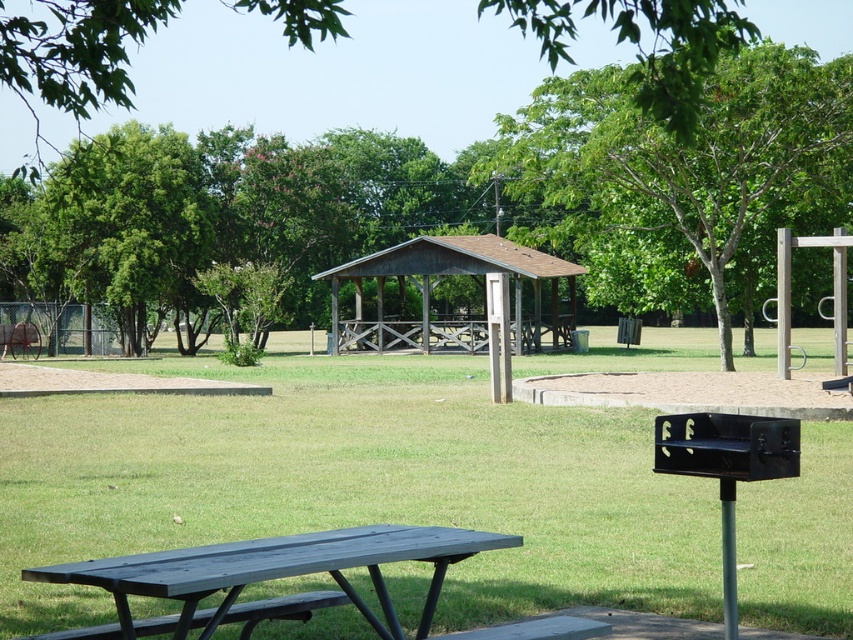
This screenshot has width=853, height=640. What do you see at coordinates (352, 484) in the screenshot?
I see `green grass at center` at bounding box center [352, 484].

You are a GUI agent. You are given a task and a screenshot of the screen. Output one action in this format:
    pyautogui.click(x=<x>, y=<y>)
    Task: Click on the green grass at center
    Image resolution: width=853 pixels, height=640 pixels.
    Given the screenshot: What is the action you would take?
    pyautogui.click(x=352, y=484)

Can you confirm if green grass at center is taller than green leafy tree at center?

No, green grass at center is not taller than green leafy tree at center.

Does green grass at center appear over green leafy tree at center?

Actually, green grass at center is below green leafy tree at center.

The width and height of the screenshot is (853, 640). What do you see at coordinates (352, 484) in the screenshot?
I see `green grass at center` at bounding box center [352, 484].

At what (x,y) coordinates should I click in order to perform the action: click on green grass at center. Please return your answer as a coordinate pair (x, y). The width and height of the screenshot is (853, 640). Looking at the image, I should click on (352, 484).

Is point (268, 620) more distant than point (589, 632)?

That is True.

Between point (120, 636) and point (550, 637), which one is positioned in front?

Positioned in front is point (550, 637).

You are a GUI agent. You are given a task and a screenshot of the screen. Output one action in this format:
    pyautogui.click(x=<x>, y=<y>)
    Task: Click on the dark gray wood bench at lower left
    The image size is (853, 640).
    Given the screenshot: What is the action you would take?
    pyautogui.click(x=281, y=609)